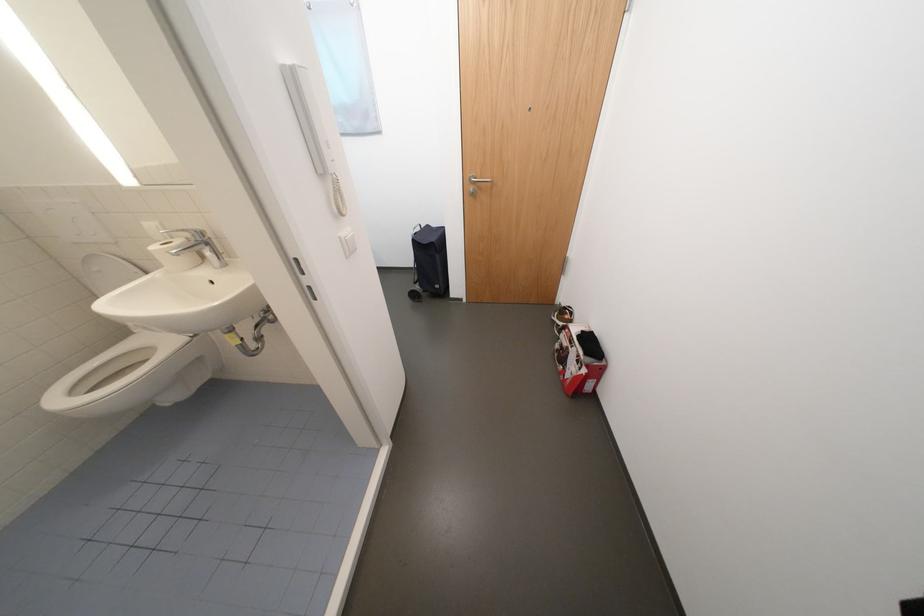
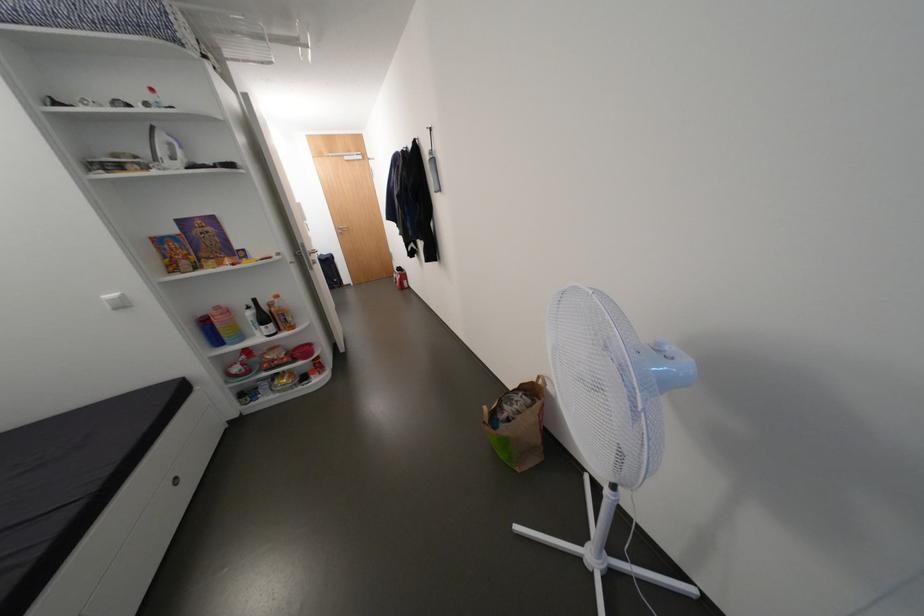
Find the pixel in the second image that matches (x=586, y=338) in the first image.

(405, 270)